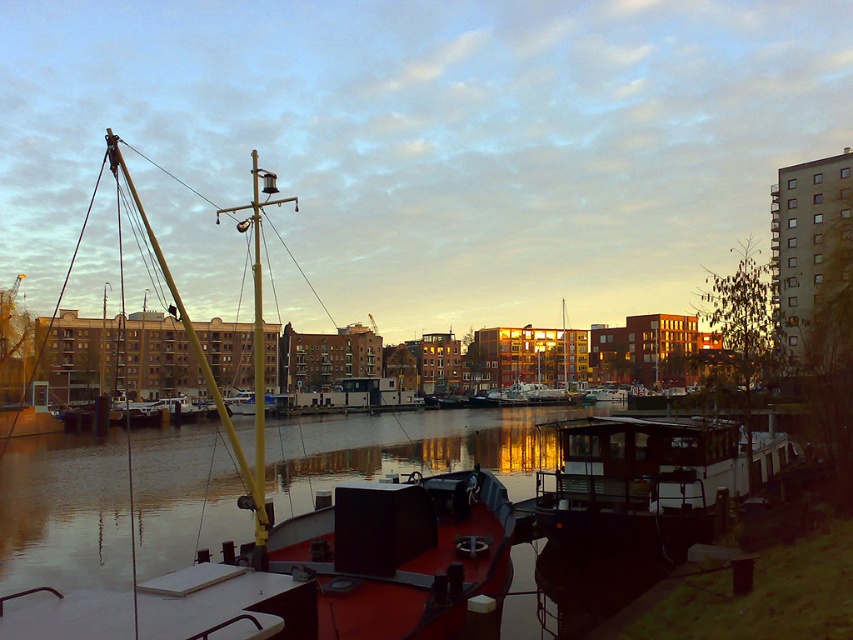
Question: Which point is farther to the camera?

Choices:
 (A) (766, 440)
 (B) (67, 604)

Answer: (A)

Question: Which point is farther to the camera?

Choices:
 (A) wooden cabin cruiser at center
 (B) smooth red boat at center

Answer: (A)

Question: Can you confirm if smooth red boat at center is positioned below wooden cabin cruiser at center?

Choices:
 (A) yes
 (B) no

Answer: (A)

Question: Does smooth red boat at center appear under wooden cabin cruiser at center?

Choices:
 (A) yes
 (B) no

Answer: (A)

Question: Considering the relative positions of smooth red boat at center and wooden cabin cruiser at center in the image provided, where is smooth red boat at center located with respect to wooden cabin cruiser at center?

Choices:
 (A) above
 (B) below

Answer: (B)